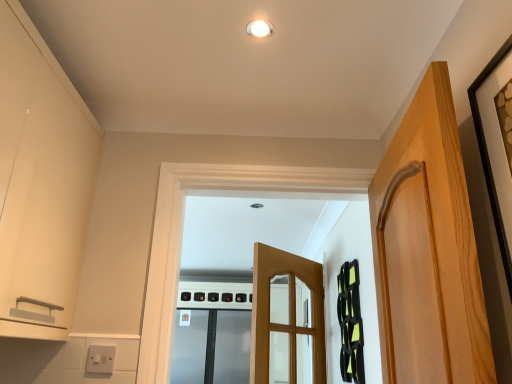
Question: In terms of size, does stainless steel refrigerator at center appear bigger or smaller than black matte picture frame at upper right?

Choices:
 (A) big
 (B) small

Answer: (A)

Question: From the image's perspective, is stainless steel refrigerator at center located above or below black matte picture frame at upper right?

Choices:
 (A) above
 (B) below

Answer: (B)

Question: Considering the real-world distances, which object is farthest from the stainless steel refrigerator at center?

Choices:
 (A) white glossy light fixture at upper center
 (B) black matte picture frame at upper right
 (C) white plastic switch at lower left
 (D) matte white cabinet at left
 (E) light brown wooden door at center, positioned as the first door in back-to-front order

Answer: (B)

Question: Which object is positioned farthest from the stainless steel refrigerator at center?

Choices:
 (A) light wood door at right, marked as the first door in a front-to-back arrangement
 (B) black matte picture frame at upper right
 (C) white glossy light fixture at upper center
 (D) white plastic switch at lower left
 (E) light brown wooden door at center, positioned as the first door in back-to-front order

Answer: (B)